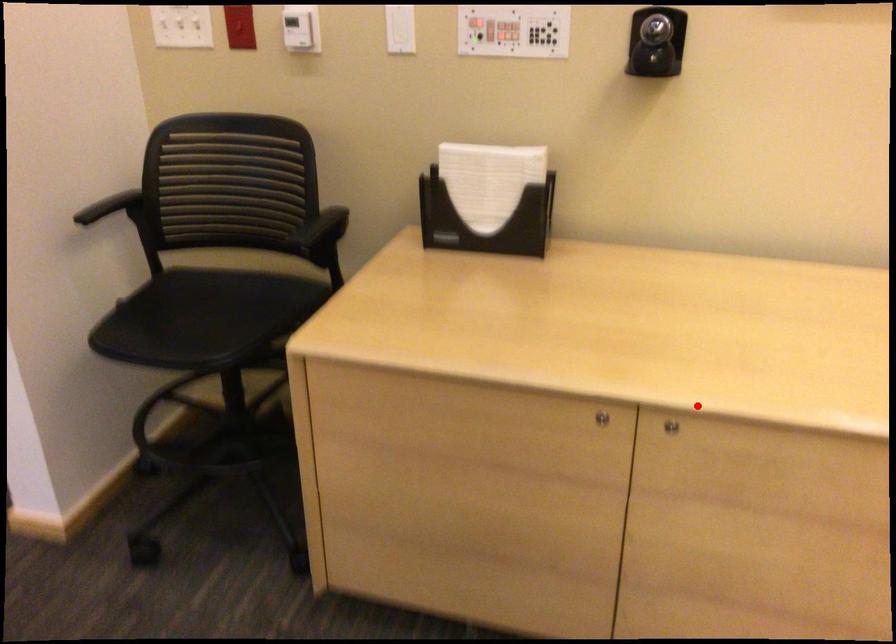
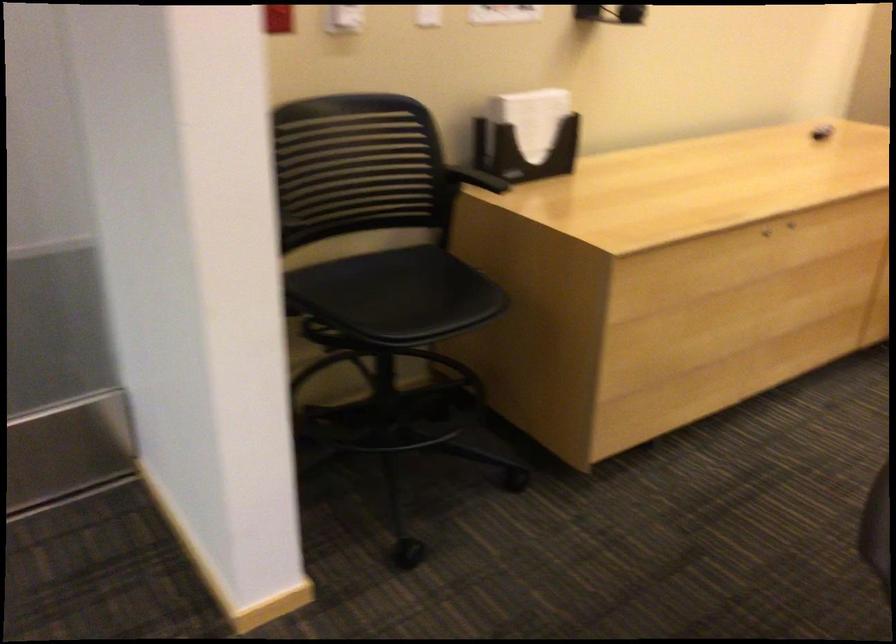
Question: A red point is marked in image1. In image2, is the corresponding 3D point closer to the camera or farther? Reply with the corresponding letter.

Choices:
 (A) The corresponding 3D point is closer.
 (B) The corresponding 3D point is farther.

Answer: (B)